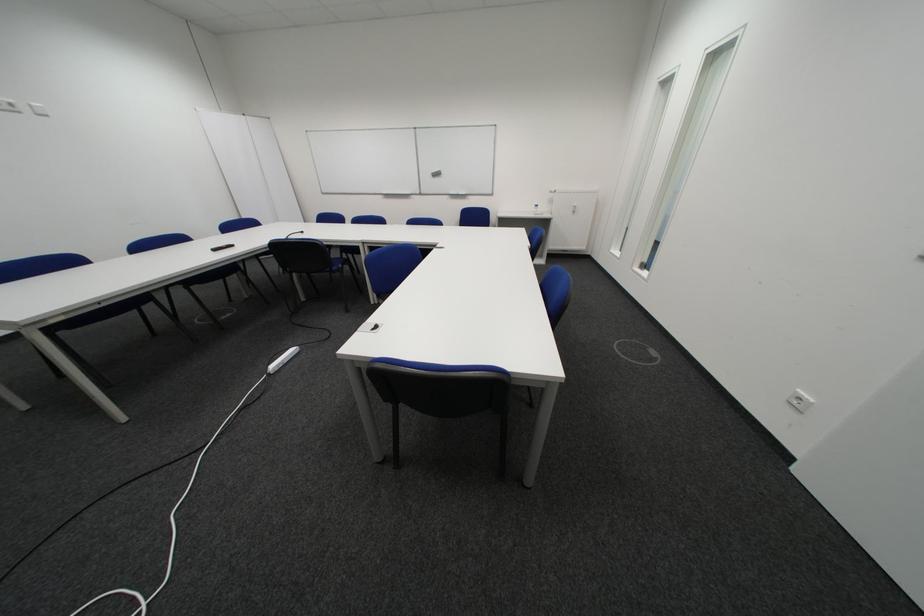
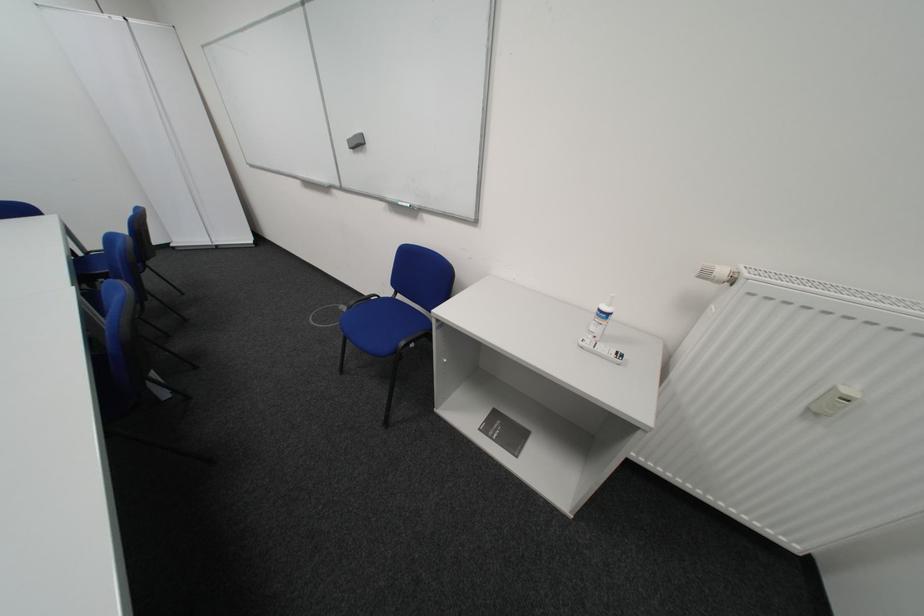
Locate, in the second image, the point that corresponds to point (444, 175) in the first image.

(361, 143)